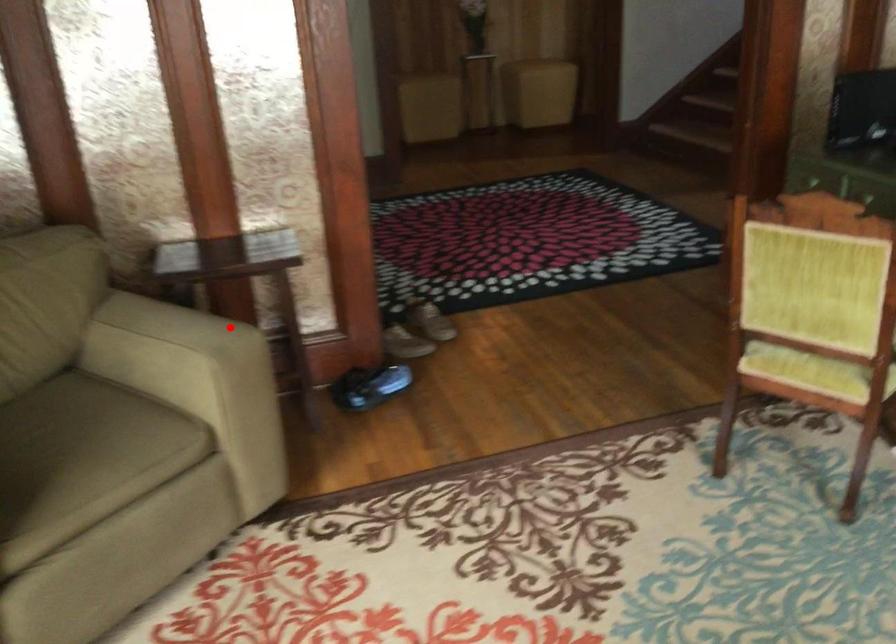
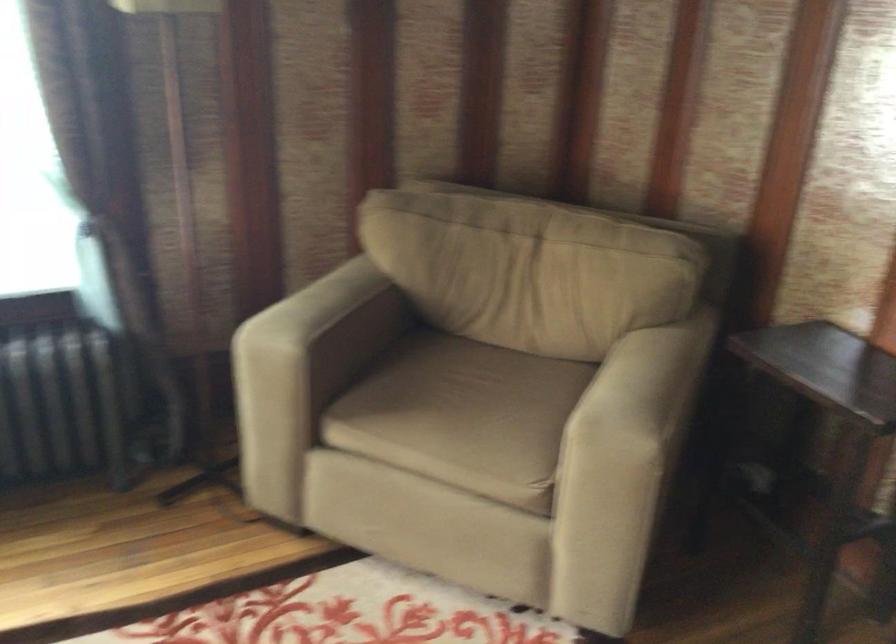
Question: A red point is marked in image1. In image2, is the corresponding 3D point closer to the camera or farther? Reply with the corresponding letter.

Choices:
 (A) The corresponding 3D point is closer.
 (B) The corresponding 3D point is farther.

Answer: (A)